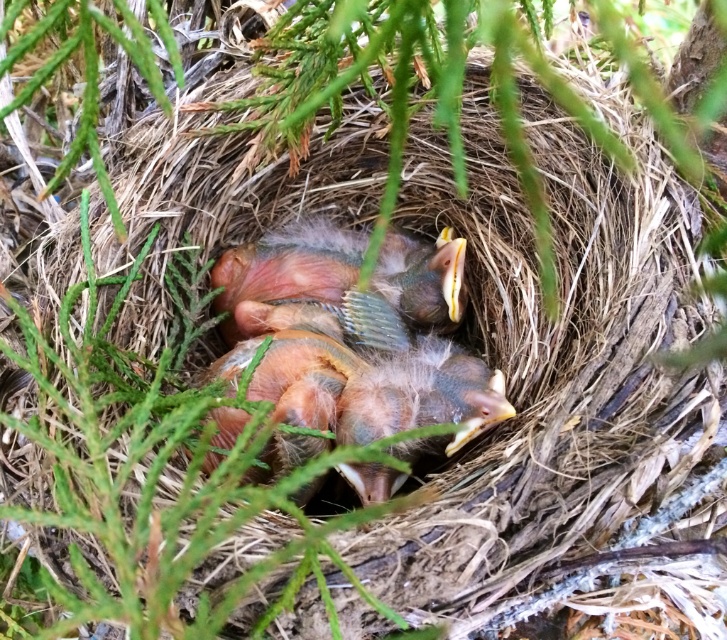
In the scene shown: Can you confirm if fluffy pinkish-brown baby bird at center is shorter than fluffy brown bird at center?

Yes, fluffy pinkish-brown baby bird at center is shorter than fluffy brown bird at center.

The height and width of the screenshot is (640, 727). I want to click on fluffy pinkish-brown baby bird at center, so click(289, 268).

Between soft brown feathers at center and fluffy brown bird at center, which one appears on the left side from the viewer's perspective?

Positioned to the left is soft brown feathers at center.

Describe the element at coordinates (341, 348) in the screenshot. I see `soft brown feathers at center` at that location.

Locate an element on the screen. soft brown feathers at center is located at coordinates (341, 348).

What do you see at coordinates (341, 348) in the screenshot?
I see `soft brown feathers at center` at bounding box center [341, 348].

Does point (246, 324) come closer to viewer compared to point (395, 288)?

Yes, point (246, 324) is closer to viewer.

Which is in front, point (292, 448) or point (446, 300)?

Point (292, 448) is in front.

I want to click on soft brown feathers at center, so click(x=341, y=348).